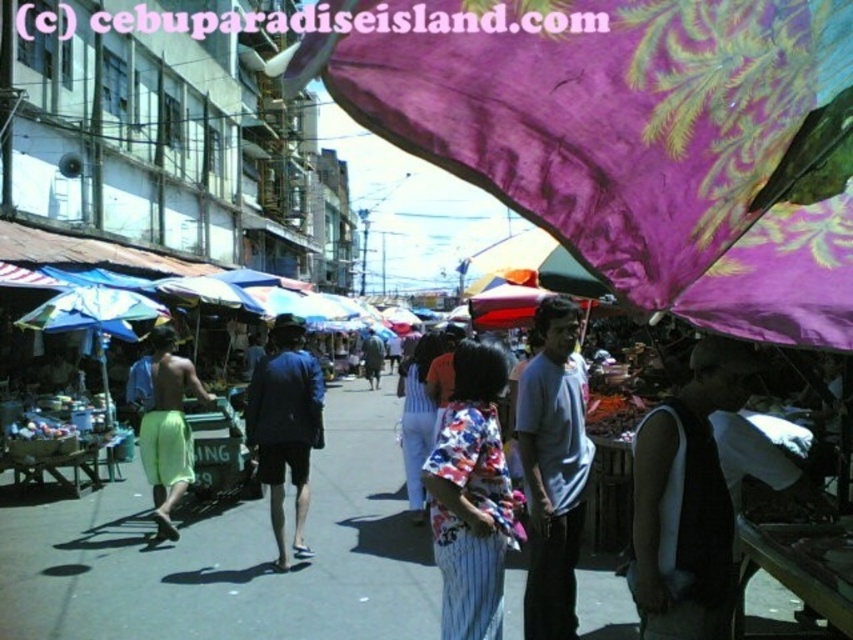
Question: Which of the following is the closest to the observer?

Choices:
 (A) (161, 358)
 (B) (444, 476)
 (C) (363, 112)
 (D) (535, 506)

Answer: (C)

Question: Can you confirm if neon yellow shorts at center is positioned to the right of dark blue shirt at center?

Choices:
 (A) yes
 (B) no

Answer: (B)

Question: Can you confirm if light blue t-shirt at center is thinner than neon yellow shorts at center?

Choices:
 (A) no
 (B) yes

Answer: (B)

Question: Does purple fabric umbrella at upper center have a greater width compared to neon yellow shorts at center?

Choices:
 (A) no
 (B) yes

Answer: (B)

Question: Which of these objects is positioned closest to the light blue t-shirt at center?

Choices:
 (A) dark gray sleeveless shirt at center
 (B) neon yellow shorts at center
 (C) floral fabric dress at center

Answer: (C)

Question: Which of the following is the farthest from the observer?

Choices:
 (A) (172, 454)
 (B) (561, 483)
 (C) (379, 378)

Answer: (C)